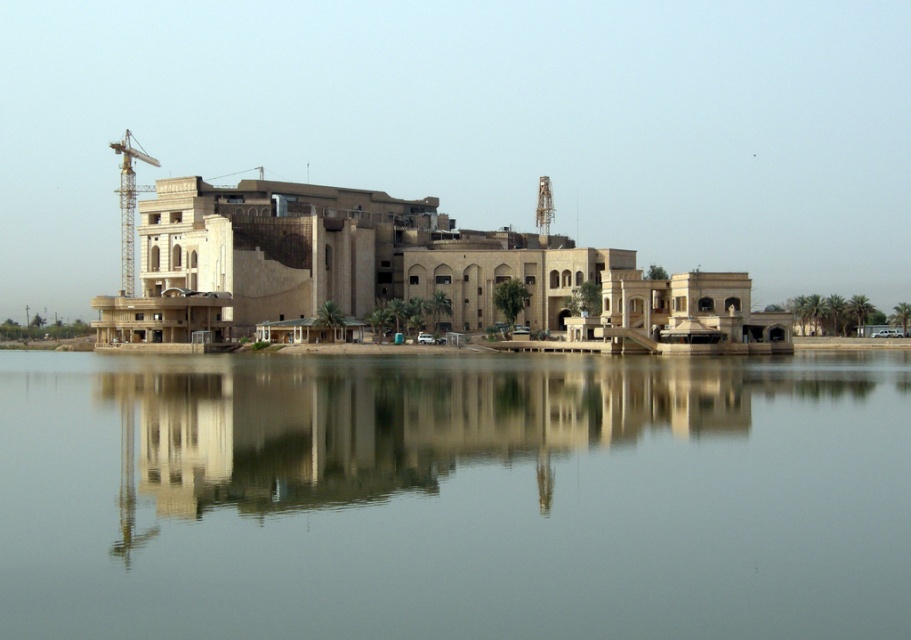
Question: Can you confirm if smooth gray water at center is positioned to the left of beige stone building at center?

Choices:
 (A) yes
 (B) no

Answer: (B)

Question: Among these objects, which one is nearest to the camera?

Choices:
 (A) beige stone building at center
 (B) yellow metallic crane at left

Answer: (A)

Question: Can you confirm if smooth gray water at center is wider than yellow metallic crane at left?

Choices:
 (A) no
 (B) yes

Answer: (B)

Question: Which object appears farthest from the camera in this image?

Choices:
 (A) yellow metallic crane at left
 (B) beige stone building at center

Answer: (A)

Question: Can you confirm if smooth gray water at center is positioned to the right of yellow metallic crane at left?

Choices:
 (A) no
 (B) yes

Answer: (B)

Question: Which object is positioned closest to the yellow metallic crane at left?

Choices:
 (A) smooth gray water at center
 (B) beige stone building at center

Answer: (B)